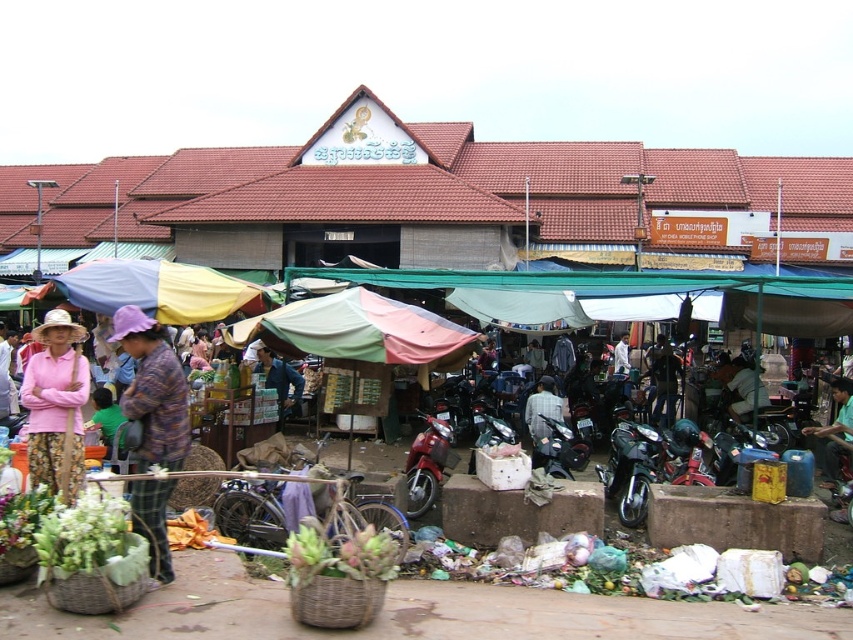
Question: Is shiny black motorcycle at center below light blue shirt at center?

Choices:
 (A) no
 (B) yes

Answer: (B)

Question: Is multicolored fabric umbrella at center further to camera compared to shiny black motorcycle at center?

Choices:
 (A) no
 (B) yes

Answer: (A)

Question: Is metallic red scooter at center to the left of blue fabric umbrella at center from the viewer's perspective?

Choices:
 (A) no
 (B) yes

Answer: (A)

Question: Which is nearer to the purple fabric hat at left?

Choices:
 (A) light blue shirt at center
 (B) blue fabric umbrella at center
 (C) multicolored fabric umbrella at center
 (D) shiny black motorcycle at center

Answer: (C)

Question: Which object is positioned farthest from the pink matte shirt at center?

Choices:
 (A) purple fabric hat at left
 (B) blue fabric umbrella at center
 (C) dark green fabric jacket at center

Answer: (C)

Question: Which object is closer to the camera taking this photo?

Choices:
 (A) dark blue fabric shirt at lower right
 (B) metallic red scooter at center
 (C) light blue shirt at center

Answer: (B)